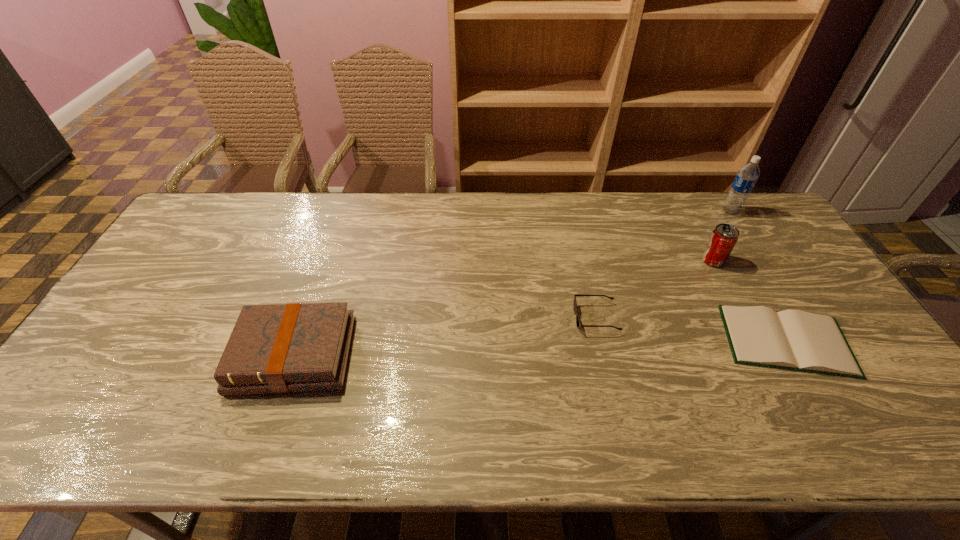
The image size is (960, 540). I want to click on vacant space that satisfies the following two spatial constraints: 1. on the back side of the right hardback book; 2. on the right side of the leftmost object, so click(300, 341).

Identify the location of vacant area in the image that satisfies the following two spatial constraints: 1. on the front lenses of the sunglasses; 2. on the front side of the leftmost object. Image resolution: width=960 pixels, height=540 pixels. (605, 355).

Identify the location of vacant region that satisfies the following two spatial constraints: 1. on the back side of the second tallest object; 2. on the left side of the left hardback book. (327, 260).